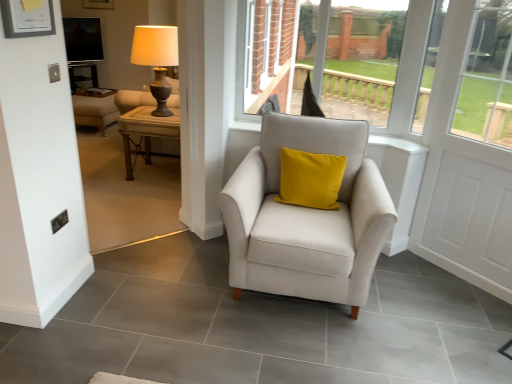
The height and width of the screenshot is (384, 512). What do you see at coordinates (125, 192) in the screenshot? I see `matte wood table at left` at bounding box center [125, 192].

Find the location of `matte black screen at upper left`. matte black screen at upper left is located at coordinates (83, 39).

Is matte black screen at upper left bigger than matte wood table at left?

No, matte black screen at upper left is not bigger than matte wood table at left.

From the image's perspective, is matte black screen at upper left located above or below matte wood table at left?

matte black screen at upper left is situated higher than matte wood table at left in the image.

Considering the sizes of objects matte black screen at upper left and matte wood table at left in the image provided, who is taller, matte black screen at upper left or matte wood table at left?

matte wood table at left is taller.

Which is more to the left, matte black screen at upper left or matte wood table at left?

matte black screen at upper left is more to the left.

From a real-world perspective, is matte white picture frame at upper left positioned under satin white armchair at center based on gravity?

Actually, matte white picture frame at upper left is physically above satin white armchair at center in the real world.

Is matte white picture frame at upper left oriented towards satin white armchair at center?

No.

Image resolution: width=512 pixels, height=384 pixels. There is a satin white armchair at center. In order to click on picture frame above it (from a real-world perspective) in this screenshot , I will do `click(27, 18)`.

Can you tell me how much matte white picture frame at upper left and satin white armchair at center differ in facing direction?

There is a 90.3-degree angle between the facing directions of matte white picture frame at upper left and satin white armchair at center.

Is white wooden screen door at right positioned far away from matte black screen at upper left?

Indeed, white wooden screen door at right is not near matte black screen at upper left.

From a real-world perspective, relative to matte black screen at upper left, is white wooden screen door at right vertically above or below?

From a real-world perspective, white wooden screen door at right is physically below matte black screen at upper left.

Is white wooden screen door at right in front of or behind matte black screen at upper left in the image?

In the image, white wooden screen door at right appears in front of matte black screen at upper left.

Is white wooden screen door at right positioned beyond the bounds of matte black screen at upper left?

Yes, white wooden screen door at right is outside of matte black screen at upper left.

Is satin white armchair at center smaller than white wooden screen door at right?

Incorrect, satin white armchair at center is not smaller in size than white wooden screen door at right.

The image size is (512, 384). What are the coordinates of `chair on the left of white wooden screen door at right` in the screenshot? It's located at (306, 217).

Looking at this image, could you tell me if satin white armchair at center is turned towards white wooden screen door at right?

No, satin white armchair at center is not turned towards white wooden screen door at right.

Is point (249, 249) more distant than point (454, 13)?

No, (249, 249) is in front of (454, 13).

Is white wooden screen door at right positioned with its back to satin white armchair at center?

No, white wooden screen door at right is not facing away from satin white armchair at center.

From the image's perspective, is white wooden screen door at right located beneath satin white armchair at center?

Incorrect, from the image's perspective, white wooden screen door at right is higher than satin white armchair at center.

Is white wooden screen door at right further to the viewer compared to satin white armchair at center?

Yes, it is behind satin white armchair at center.

Does point (511, 174) come closer to viewer compared to point (246, 205)?

No, (511, 174) is further to viewer.

How different are the orientations of white wooden screen door at right and woodenmaterial/texturetable at left in degrees?

47.3 degrees.

Are white wooden screen door at right and woodenmaterial/texturetable at left making contact?

There is a gap between white wooden screen door at right and woodenmaterial/texturetable at left.

Can you confirm if white wooden screen door at right is smaller than woodenmaterial/texturetable at left?

Correct, white wooden screen door at right occupies less space than woodenmaterial/texturetable at left.

Considering the points (444, 179) and (127, 143), which point is behind, point (444, 179) or point (127, 143)?

The point (127, 143) is behind.

Is matte gold table lamp at upper left inside matte white picture frame at upper left?

No.

Considering the sizes of objects matte white picture frame at upper left and matte gold table lamp at upper left in the image provided, who is shorter, matte white picture frame at upper left or matte gold table lamp at upper left?

With less height is matte white picture frame at upper left.

Is matte white picture frame at upper left turned away from matte gold table lamp at upper left?

No, matte white picture frame at upper left is not facing away from matte gold table lamp at upper left.

Would you say matte white picture frame at upper left is a long distance from matte gold table lamp at upper left?

Yes, matte white picture frame at upper left and matte gold table lamp at upper left are quite far apart.

In the image, there is a matte black screen at upper left. At what (x,y) coordinates should I click in order to perform the action: click on backyard below it (from a real-world perspective). Please return your answer as a coordinate pair (x, y). This screenshot has width=512, height=384. Looking at the image, I should click on (125, 192).

At what (x,y) coordinates should I click in order to perform the action: click on chair below the matte white picture frame at upper left (from the image's perspective). Please return your answer as a coordinate pair (x, y). The width and height of the screenshot is (512, 384). Looking at the image, I should click on (306, 217).

When comparing their distances from matte wood table at left, does matte white picture frame at upper left or woodenmaterial/texturetable at left seem closer?

woodenmaterial/texturetable at left is closer to matte wood table at left.

Estimate the real-world distances between objects in this image. Which object is further from matte wood table at left, matte black screen at upper left or matte gold table lamp at upper left?

matte black screen at upper left lies further to matte wood table at left than the other object.

From the image, which object appears to be farther from matte black screen at upper left, matte white picture frame at upper left or matte gold table lamp at upper left?

matte white picture frame at upper left is positioned further to the anchor matte black screen at upper left.

Looking at the image, which one is located closer to matte white picture frame at upper left, matte black screen at upper left or white wooden screen door at right?

white wooden screen door at right is closer to matte white picture frame at upper left.

From the image, which object appears to be nearer to woodenmaterial/texturetable at left, satin white armchair at center or matte gold table lamp at upper left?

matte gold table lamp at upper left is closer to woodenmaterial/texturetable at left.

Estimate the real-world distances between objects in this image. Which object is closer to satin white armchair at center, matte black screen at upper left or matte gold table lamp at upper left?

matte gold table lamp at upper left lies closer to satin white armchair at center than the other object.

Which object lies further to the anchor point white wooden screen door at right, woodenmaterial/texturetable at left or matte white picture frame at upper left?

The object further to white wooden screen door at right is matte white picture frame at upper left.

Which object lies further to the anchor point matte wood table at left, matte white picture frame at upper left or satin white armchair at center?

matte white picture frame at upper left.

You are a GUI agent. You are given a task and a screenshot of the screen. Output one action in this format:
    pyautogui.click(x=<x>, y=<y>)
    Task: Click on the backyard located between matte white picture frame at upper left and white wooden screen door at right in the left-right direction
    The height and width of the screenshot is (384, 512).
    Given the screenshot: What is the action you would take?
    pyautogui.click(x=125, y=192)

In order to click on table lamp positioned between matte white picture frame at upper left and woodenmaterial/texturetable at left from near to far in this screenshot , I will do `click(156, 59)`.

Where is `screen door located between matte white picture frame at upper left and matte black screen at upper left in the depth direction`? Image resolution: width=512 pixels, height=384 pixels. screen door located between matte white picture frame at upper left and matte black screen at upper left in the depth direction is located at coordinates (469, 153).

Find the location of a particular element. The width and height of the screenshot is (512, 384). table located between matte white picture frame at upper left and matte black screen at upper left in the depth direction is located at coordinates (146, 131).